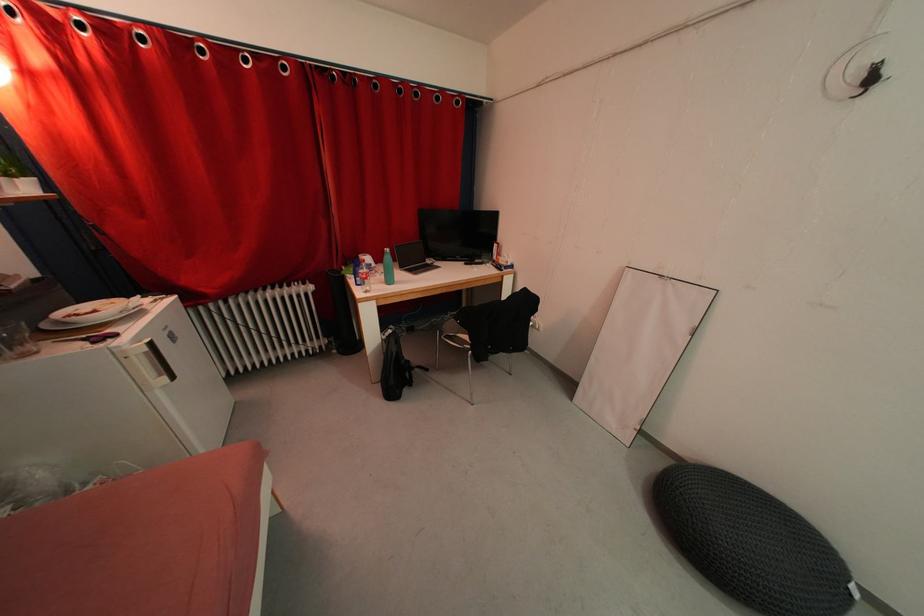
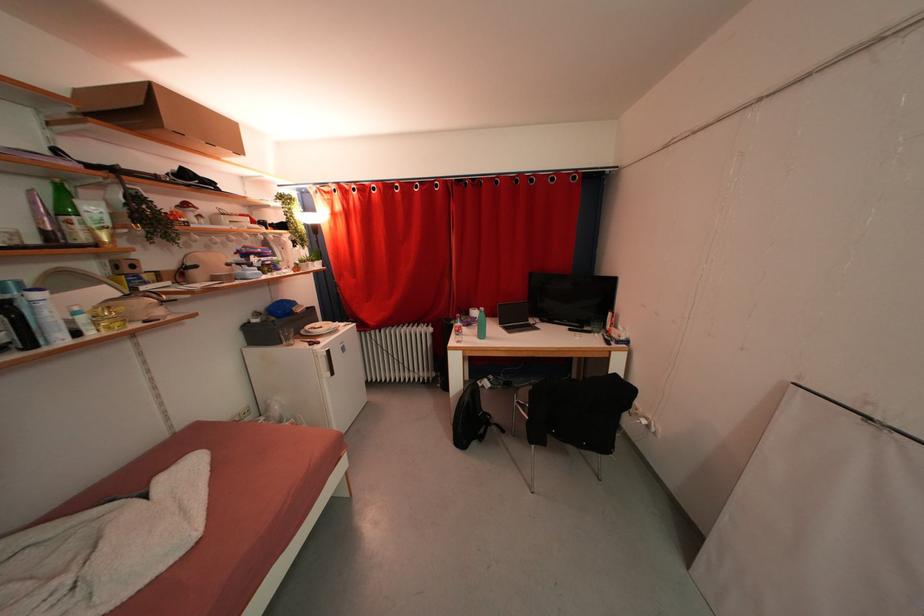
The point at [317,291] is marked in the first image. Where is the corresponding point in the second image?

(436, 333)